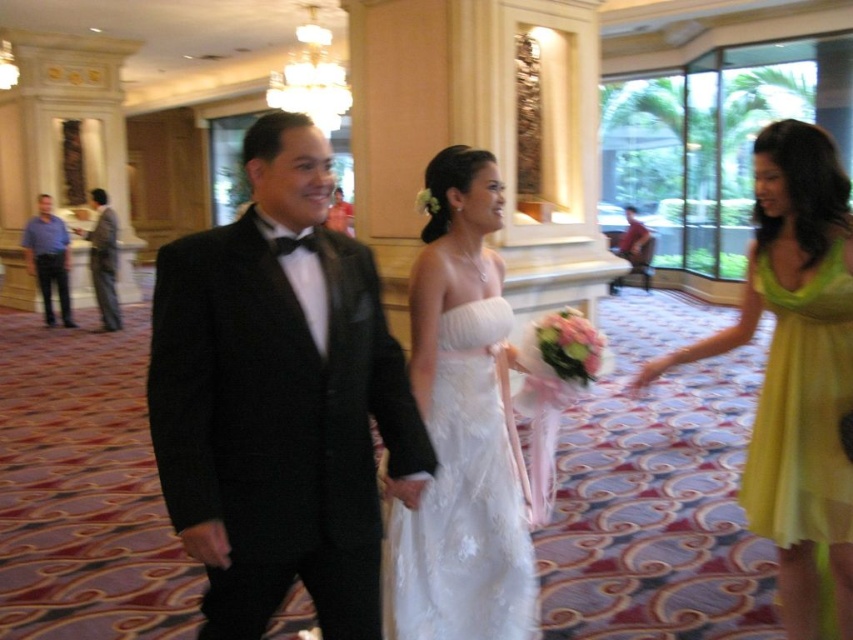
Question: Which point is farther from the camera taking this photo?

Choices:
 (A) (184, 360)
 (B) (482, 419)
 (C) (114, 298)
 (D) (762, 536)

Answer: (C)

Question: Is white satin dress at center positioned in front of shiny black suit at left?

Choices:
 (A) yes
 (B) no

Answer: (A)

Question: Which object is positioned farthest from the shiny black tuxedo at center?

Choices:
 (A) white satin dress at center
 (B) green satin dress at right

Answer: (B)

Question: Which of the following is the farthest from the observer?

Choices:
 (A) shiny black tuxedo at center
 (B) white satin dress at center

Answer: (B)

Question: Does matte green dress at right appear on the right side of green satin dress at right?

Choices:
 (A) no
 (B) yes

Answer: (A)

Question: Considering the relative positions of shiny black tuxedo at center and blue shirt at left in the image provided, where is shiny black tuxedo at center located with respect to blue shirt at left?

Choices:
 (A) left
 (B) right

Answer: (B)